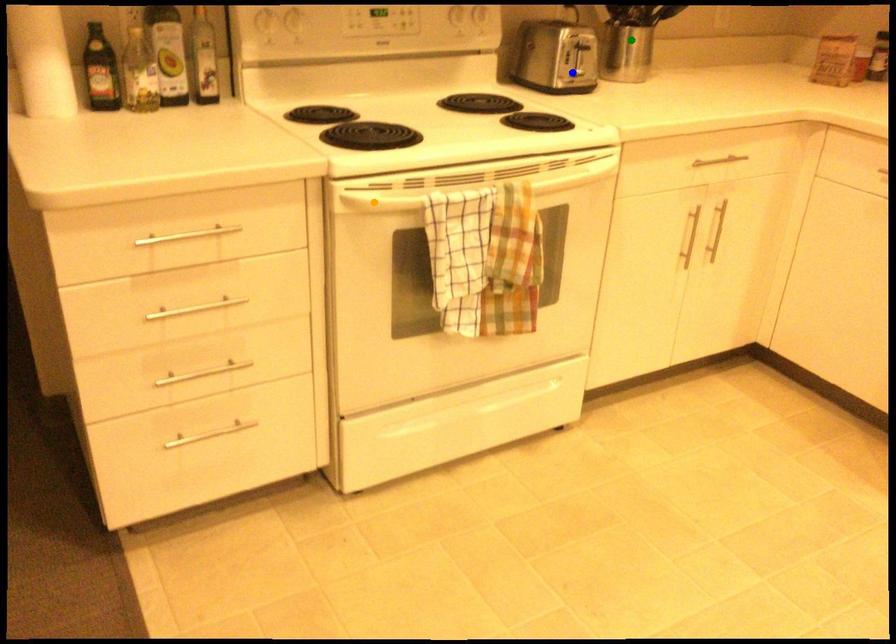
From the picture: Order these from nearest to farthest:
1. orange point
2. blue point
3. green point

orange point < blue point < green point